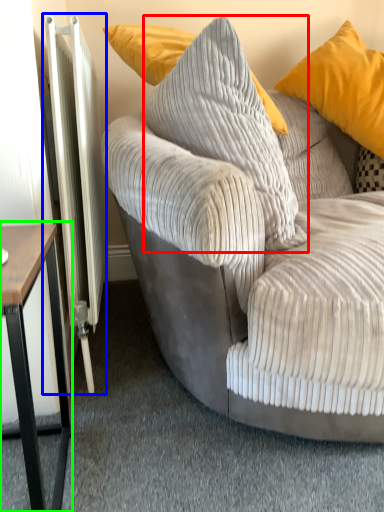
Question: Considering the real-world distances, which object is farthest from pillow (highlighted by a red box)? radiator (highlighted by a blue box) or table (highlighted by a green box)?

Choices:
 (A) radiator
 (B) table

Answer: (B)